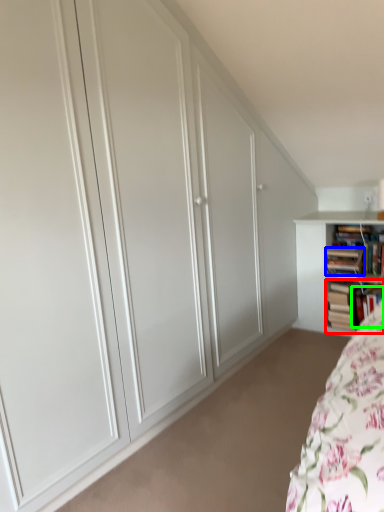
Question: Which is farther away from book (highlighted by a red box)? book (highlighted by a blue box) or book (highlighted by a green box)?

Choices:
 (A) book
 (B) book

Answer: (A)